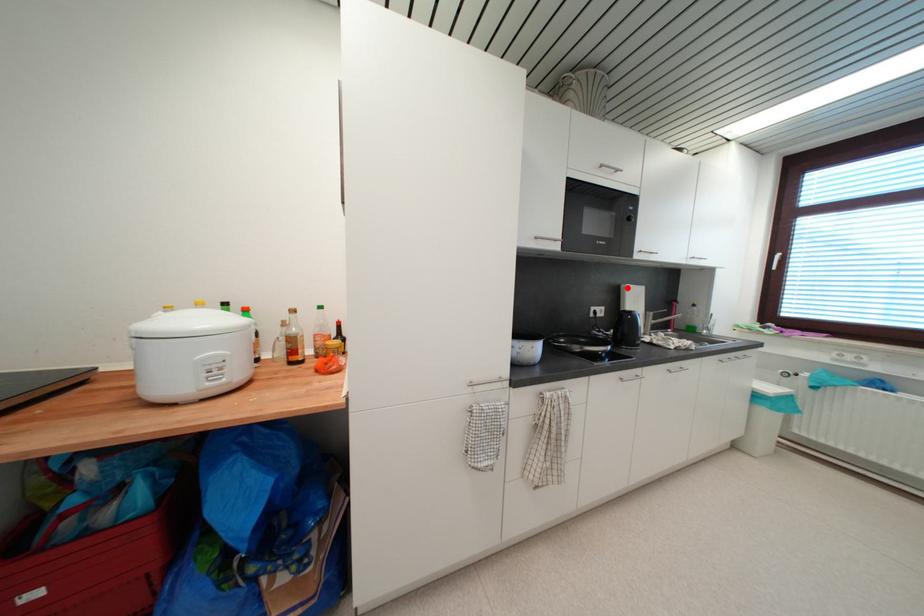
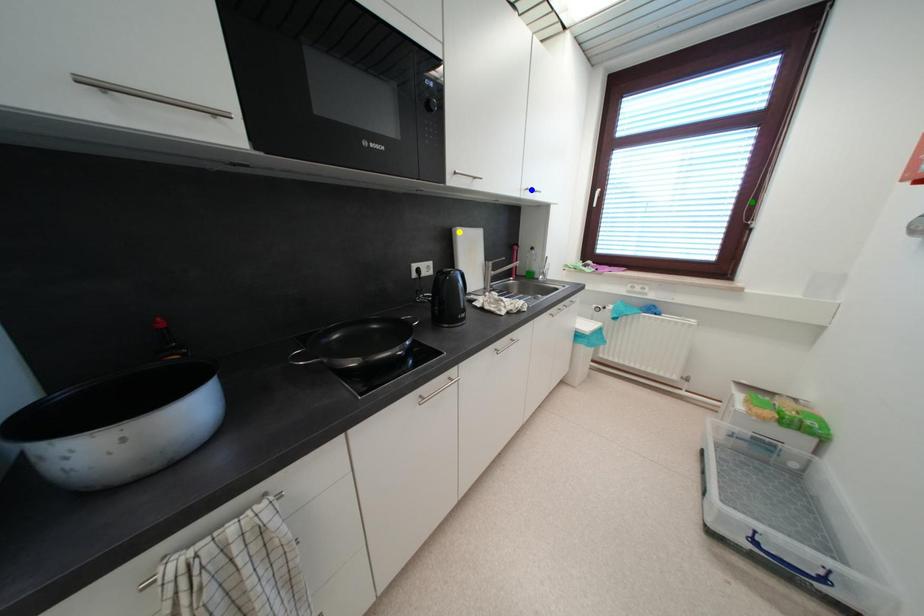
Question: I am providing you with two images of the same scene from different viewpoints. A red point is marked on the first image. You are given multiple points on the second image. Which spot in image 2 lines up with the point in image 1?

Choices:
 (A) blue point
 (B) yellow point
 (C) green point

Answer: (B)